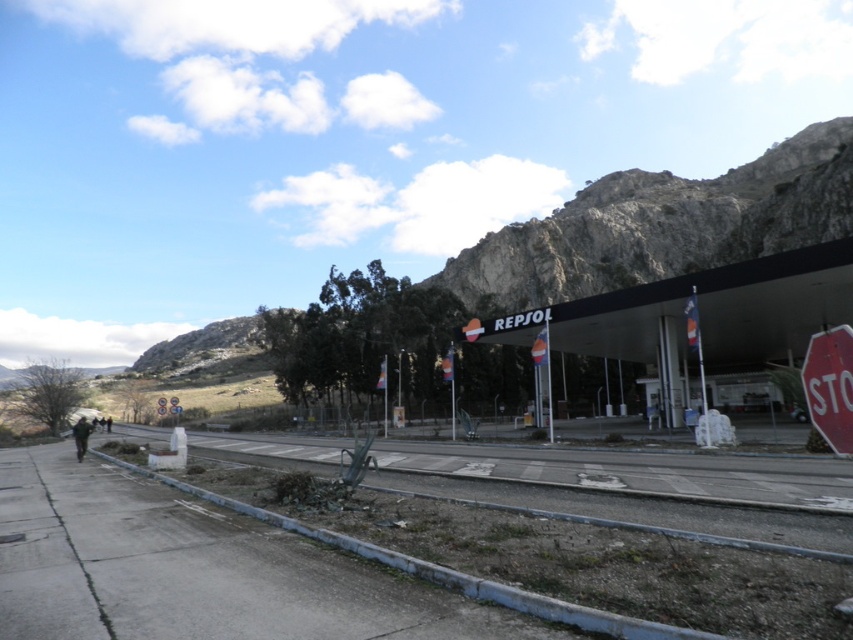
Which is in front, point (471, 625) or point (86, 426)?

Point (471, 625)

Locate an element on the screen. gray concrete pavement at lower left is located at coordinates [x=195, y=570].

At what (x,y) coordinates should I click in order to perform the action: click on gray concrete pavement at lower left. Please return your answer as a coordinate pair (x, y). The width and height of the screenshot is (853, 640). Looking at the image, I should click on (195, 570).

Looking at this image, which is below, gray concrete train track at lower center or dark gray jacket at lower left?

dark gray jacket at lower left is lower down.

Between gray concrete train track at lower center and dark gray jacket at lower left, which one has less height?

With less height is gray concrete train track at lower center.

Locate an element on the screen. gray concrete train track at lower center is located at coordinates (639, 508).

Is gray concrete train track at lower center bigger than red matte stop sign at lower right?

Correct, gray concrete train track at lower center is larger in size than red matte stop sign at lower right.

This screenshot has width=853, height=640. What do you see at coordinates (639, 508) in the screenshot? I see `gray concrete train track at lower center` at bounding box center [639, 508].

Is point (523, 506) positioned before point (846, 337)?

No, it is not.

You are a GUI agent. You are given a task and a screenshot of the screen. Output one action in this format:
    pyautogui.click(x=<x>, y=<y>)
    Task: Click on the gray concrete train track at lower center
    The height and width of the screenshot is (640, 853).
    Given the screenshot: What is the action you would take?
    pyautogui.click(x=639, y=508)